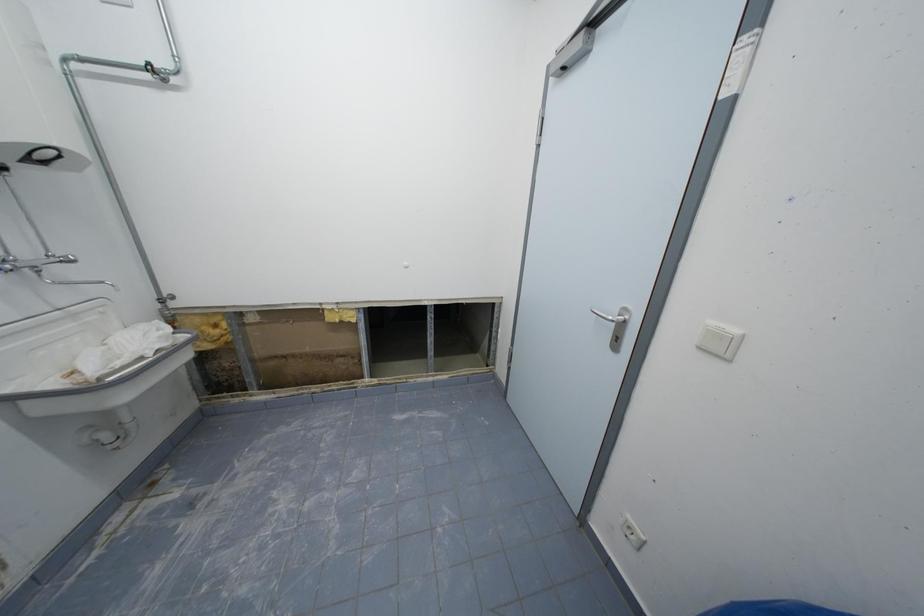
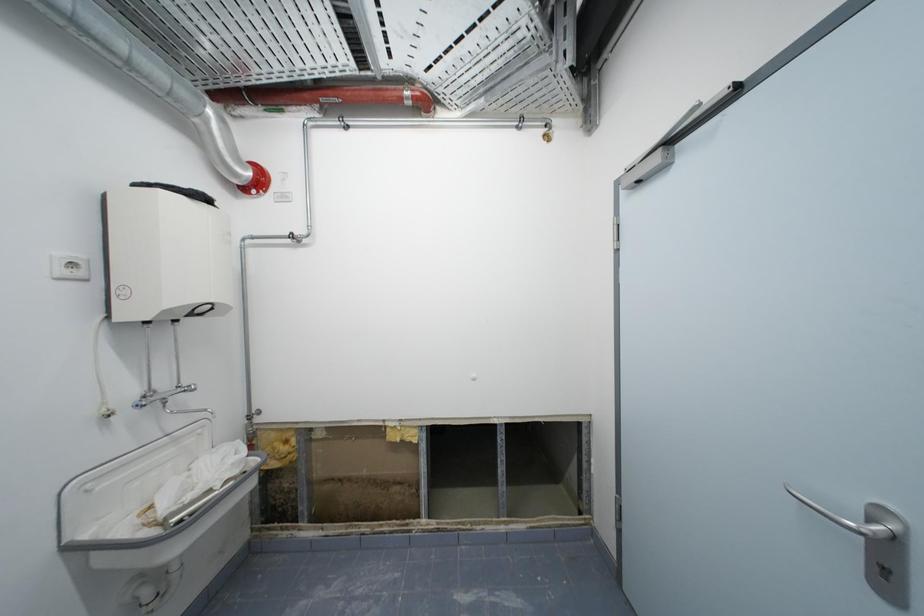
Which direction would the cameraman need to move to produce the second image?

The cameraman walked toward left, forward.